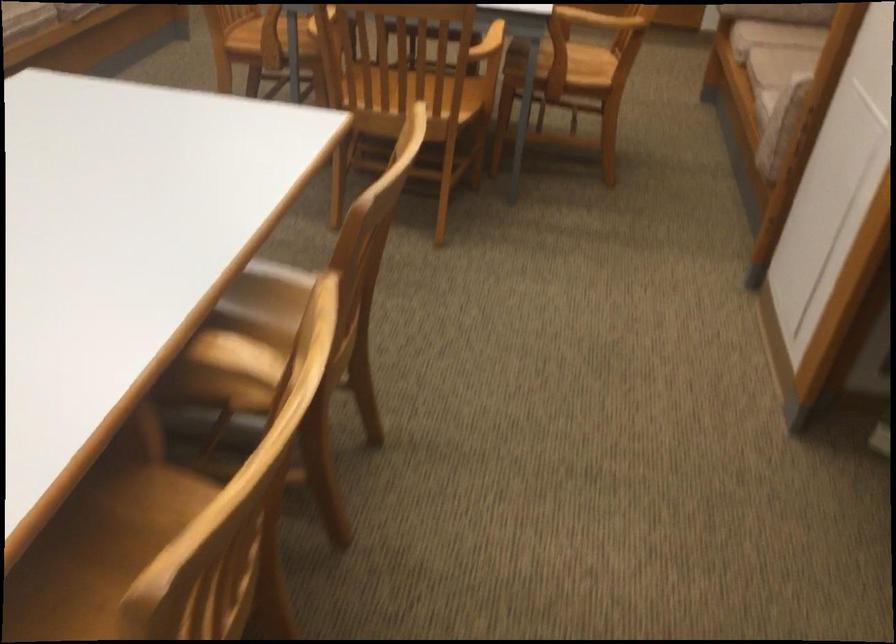
Identify the location of sofa sitting surface. The width and height of the screenshot is (896, 644). (782, 33).